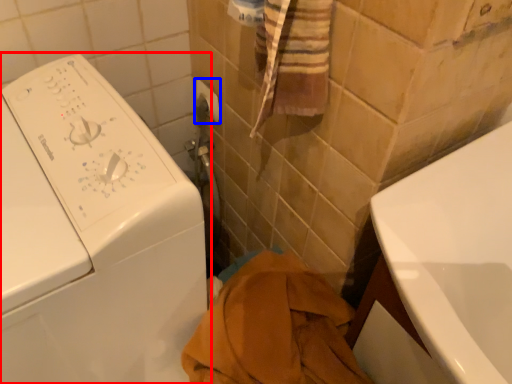
Question: Which object appears farthest to the camera in this image, washing machine (highlighted by a red box) or towel bar (highlighted by a blue box)?

Choices:
 (A) washing machine
 (B) towel bar

Answer: (B)